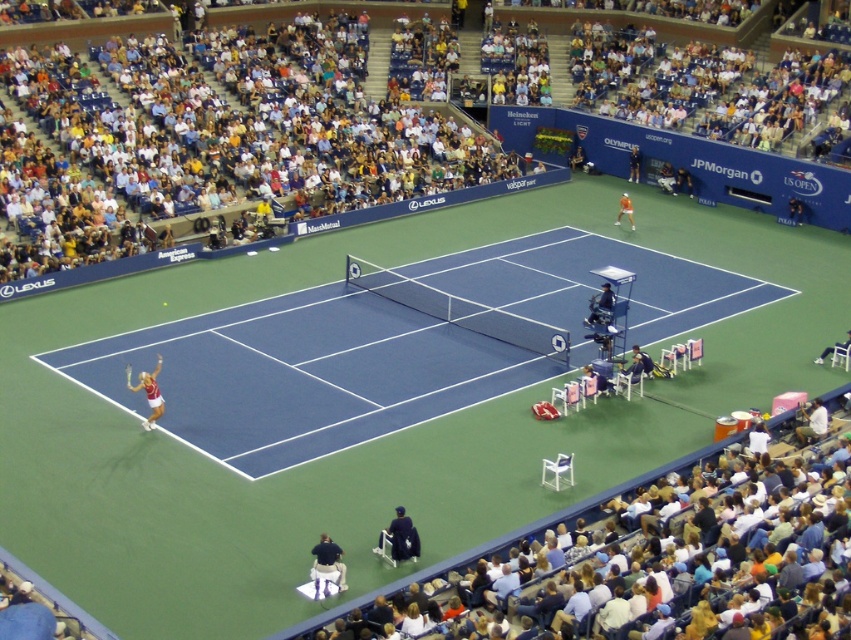
You are a photographer at the US Open tennis match. You need to capture a photo of the orange shirt at upper right without the blue synthetic turf at lower left appearing in the foreground. Is this possible based on their positions?

The blue synthetic turf at lower left is positioned under the orange shirt at upper right, which means the orange shirt is above the blue synthetic turf. Since the orange shirt is higher up, the photographer can angle the camera to avoid the blue synthetic turf at lower left appearing in the foreground while focusing on the orange shirt at upper right.

Based on the photo, you are a tennis ball currently at point (195, 337) on the court. You want to reach the baseline, which is 28 meters away from the camera. Can you estimate whether you are closer to the baseline or the net?

The distance between point (195, 337) and the camera is 27.64 meters, which is slightly less than the 28 meters to the baseline. Therefore, the tennis ball is closer to the baseline than the net.

You are a photographer standing at the center of the tennis court. You want to place a 1.5 meter wide equipment bag between the blue synthetic turf at lower left and the orange fabric chair at upper right. Can you fit it there?

The blue synthetic turf at lower left might be wider than orange fabric chair at upper right, so the equipment bag may or may not fit depending on the exact width. Check the actual distance before placing the bag.